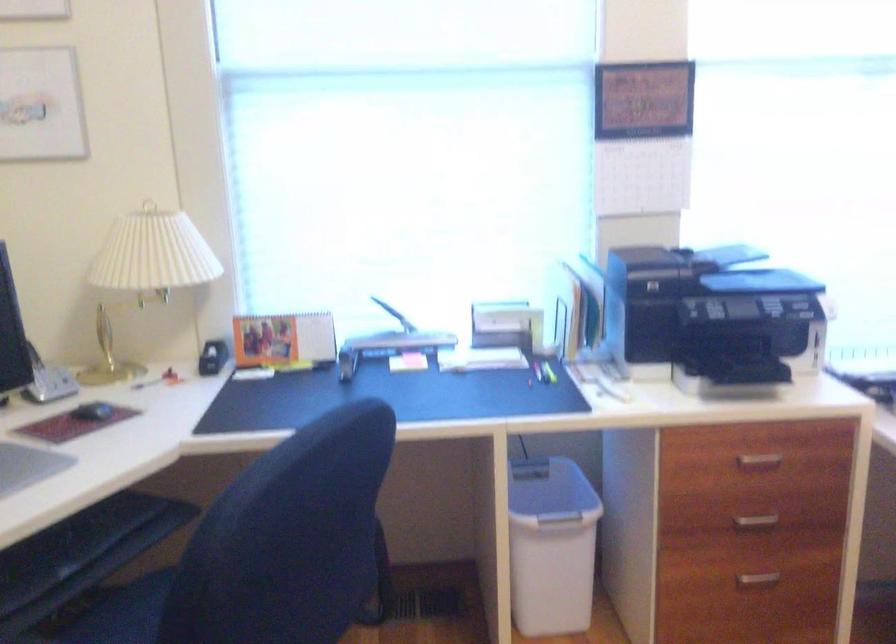
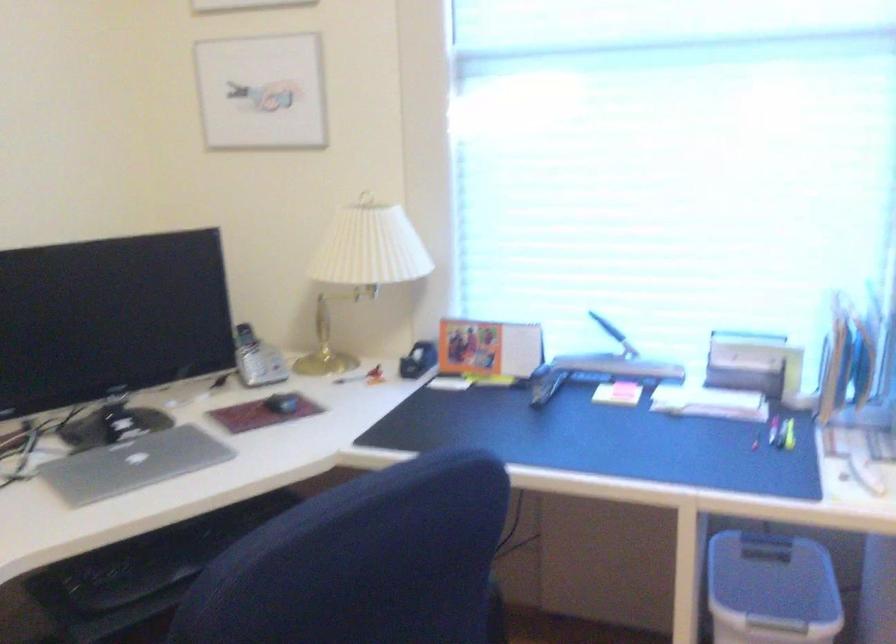
Find the pixel in the second image that matches pixel 99 413 in the first image.

(281, 402)